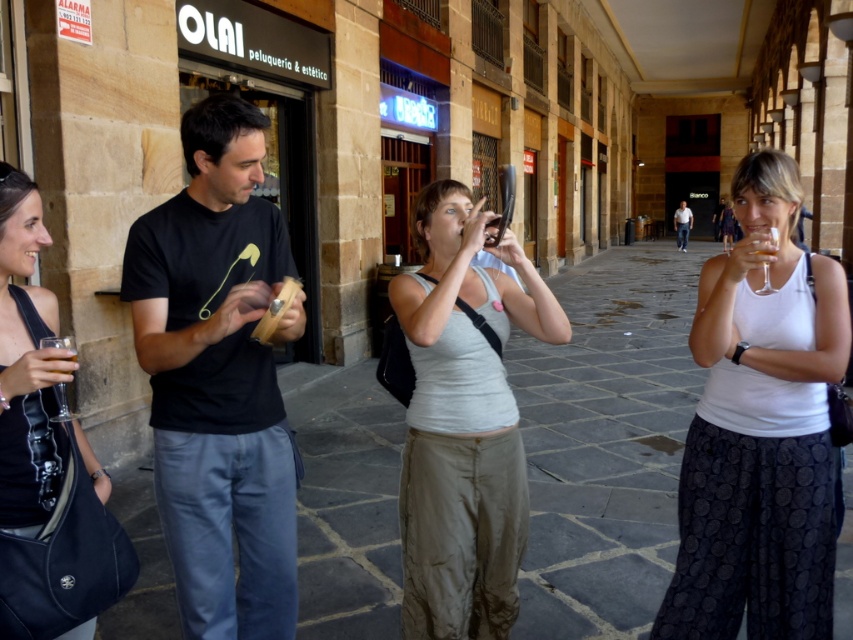
Question: Where is black matte t-shirt at center located in relation to white cotton tank top at center in the image?

Choices:
 (A) below
 (B) above

Answer: (B)

Question: Which object is positioned closest to the translucent glass at upper right?

Choices:
 (A) black leather bag at lower left
 (B) light blue jeans at center

Answer: (A)

Question: Is black matte t-shirt at center further to camera compared to translucent glass at upper right?

Choices:
 (A) no
 (B) yes

Answer: (A)

Question: Which object is farther from the camera taking this photo?

Choices:
 (A) gray cotton tank top at center
 (B) black leather bag at lower left
 (C) light blue jeans at center

Answer: (C)

Question: Is white cotton tank top at center closer to the viewer compared to gray cotton tank top at center?

Choices:
 (A) yes
 (B) no

Answer: (A)

Question: Which object is the farthest from the white cotton tank top at center?

Choices:
 (A) black matte t-shirt at center
 (B) gray cotton tank top at center

Answer: (A)